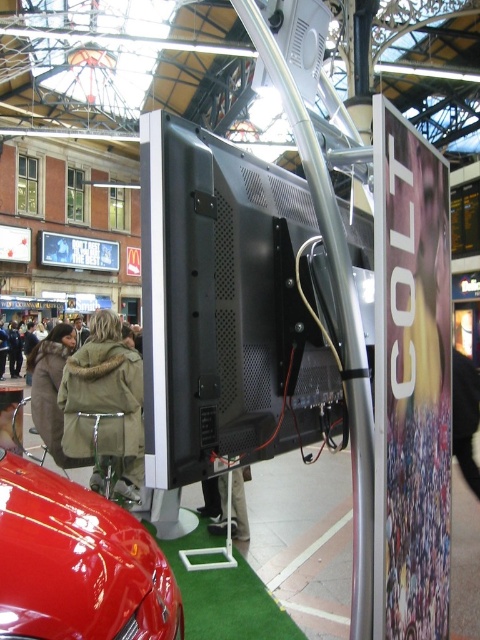
Question: Which point is closer to the camera?

Choices:
 (A) glossy red car at lower left
 (B) khaki fur-lined coat at center

Answer: (A)

Question: Considering the relative positions of khaki fur-lined coat at center and khaki fabric jacket at center in the image provided, where is khaki fur-lined coat at center located with respect to khaki fabric jacket at center?

Choices:
 (A) right
 (B) left

Answer: (B)

Question: Does glossy red car at lower left appear on the left side of khaki fabric jacket at center?

Choices:
 (A) yes
 (B) no

Answer: (A)

Question: Considering the real-world distances, which object is closest to the khaki fabric jacket at center?

Choices:
 (A) khaki fur-lined coat at center
 (B) glossy red car at lower left

Answer: (A)

Question: Among these objects, which one is farthest from the camera?

Choices:
 (A) khaki fur-lined coat at center
 (B) glossy red car at lower left
 (C) khaki fabric jacket at center

Answer: (C)

Question: Is the position of khaki fur-lined coat at center less distant than that of khaki fabric jacket at center?

Choices:
 (A) yes
 (B) no

Answer: (A)